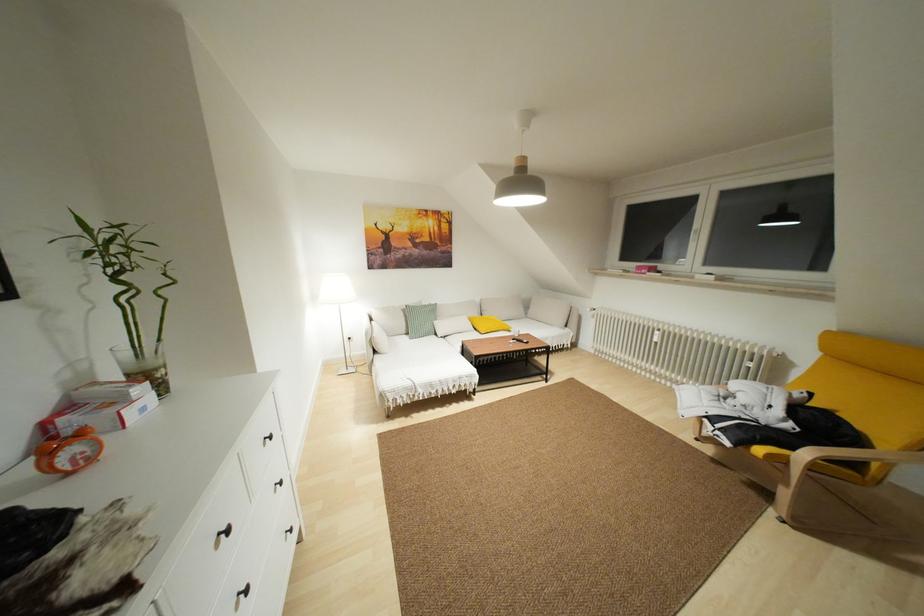
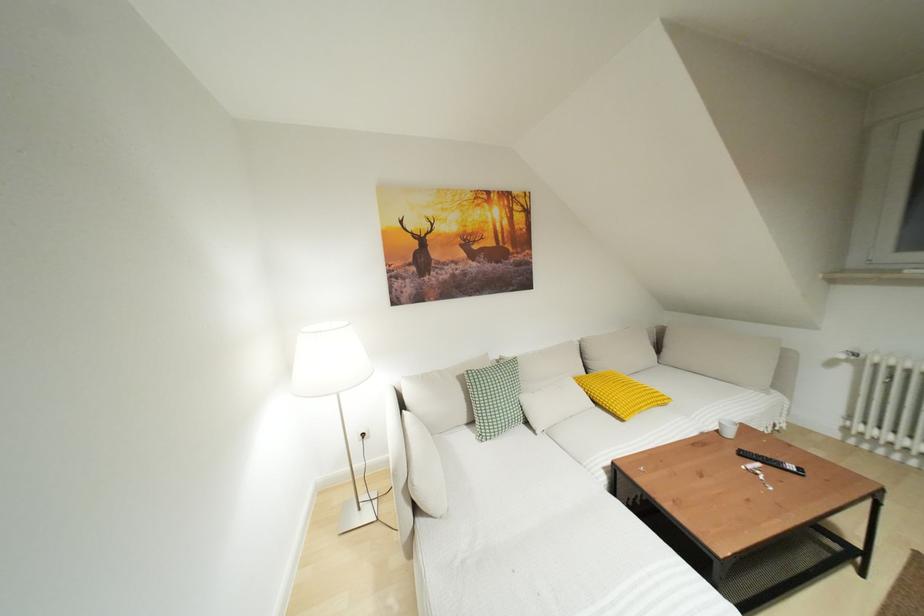
What movement of the cameraman would produce the second image?

The cameraman walked toward left, forward.